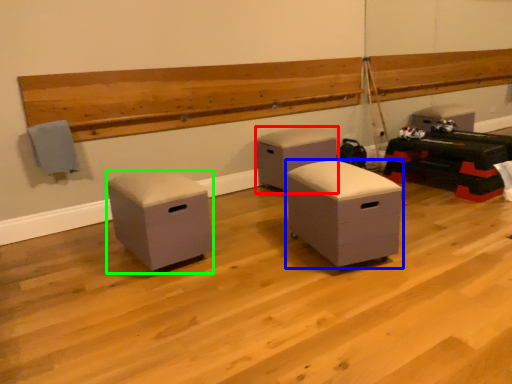
Question: Based on their relative distances, which object is nearer to furniture (highlighted by a red box)? Choose from furniture (highlighted by a blue box) and furniture (highlighted by a green box).

Choices:
 (A) furniture
 (B) furniture

Answer: (A)